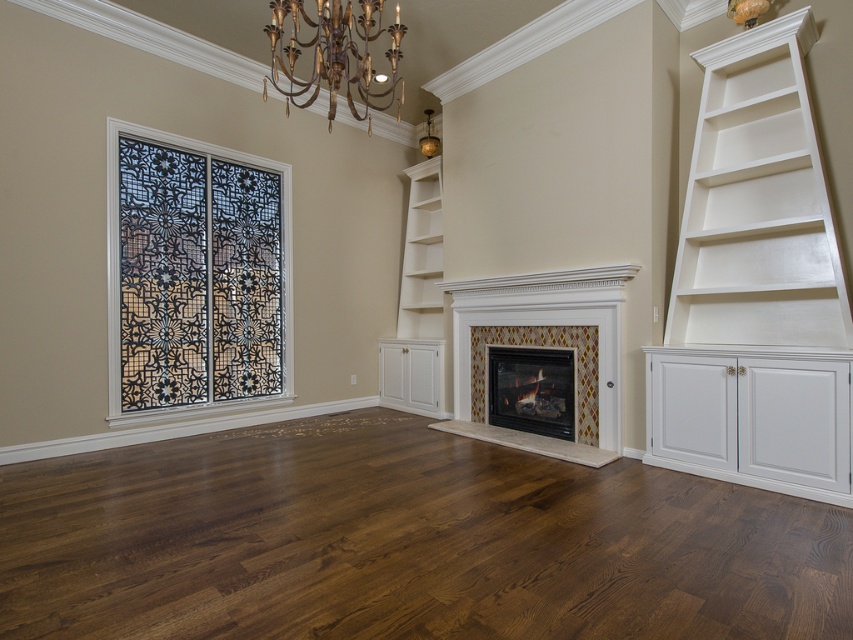
Is point (328, 24) farther from camera compared to point (556, 396)?

No, (328, 24) is in front of (556, 396).

Which is below, gold metallic chandelier at upper center or matte black fireplace at center?

matte black fireplace at center

This screenshot has width=853, height=640. What do you see at coordinates (335, 52) in the screenshot? I see `gold metallic chandelier at upper center` at bounding box center [335, 52].

Locate an element on the screen. gold metallic chandelier at upper center is located at coordinates (335, 52).

Is white painted wood bookshelf at right positioned in front of matte black fireplace at center?

Yes.

Is point (770, 349) closer to viewer compared to point (489, 406)?

Yes, point (770, 349) is closer to viewer.

Find the location of a particular element. The width and height of the screenshot is (853, 640). white painted wood bookshelf at right is located at coordinates (756, 284).

Which is in front, point (154, 452) or point (810, 115)?

Point (810, 115)

What do you see at coordinates (404, 541) in the screenshot? I see `dark brown wood flooring at center` at bounding box center [404, 541].

Identify the location of dark brown wood flooring at center. (404, 541).